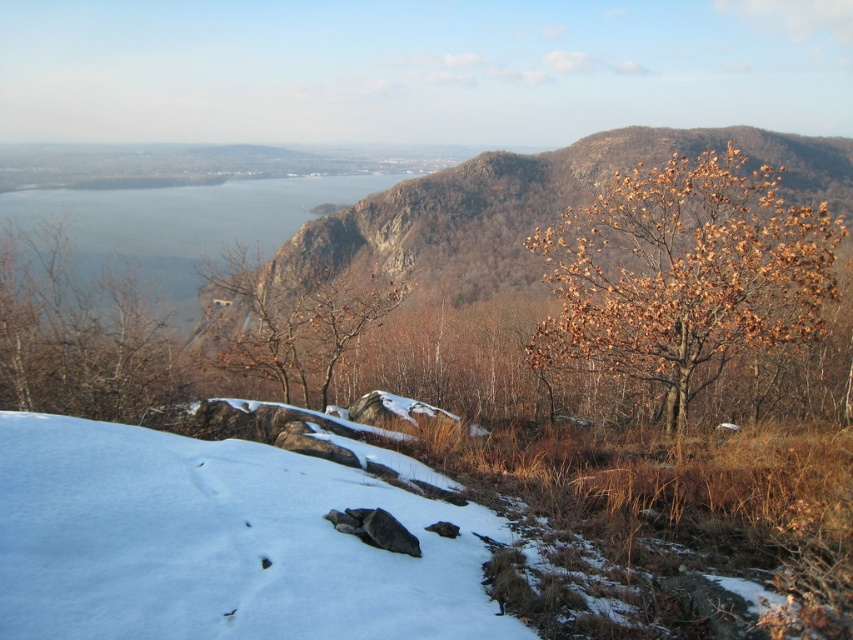
Describe the element at coordinates (218, 541) in the screenshot. I see `white fluffy snow at lower left` at that location.

Between white fluffy snow at lower left and brown leafy tree at center, which one is positioned lower?

white fluffy snow at lower left is below.

The width and height of the screenshot is (853, 640). Identify the location of white fluffy snow at lower left. (218, 541).

The height and width of the screenshot is (640, 853). Find the location of `white fluffy snow at lower left`. white fluffy snow at lower left is located at coordinates (218, 541).

What are the coordinates of `blue water at left` in the screenshot? It's located at (178, 225).

In the scene shown: Which is above, blue water at left or brown leafy tree at center?

blue water at left is above.

Between point (238, 196) and point (305, 369), which one is positioned in front?

Point (305, 369) is in front.

This screenshot has height=640, width=853. I want to click on blue water at left, so click(178, 225).

Between white fluffy snow at lower left and brown leafy tree at left, which one has more height?

brown leafy tree at left is taller.

Which is more to the left, white fluffy snow at lower left or brown leafy tree at left?

From the viewer's perspective, brown leafy tree at left appears more on the left side.

Is point (244, 557) closer to viewer compared to point (61, 403)?

Yes, it is.

In order to click on white fluffy snow at lower left in this screenshot , I will do `click(218, 541)`.